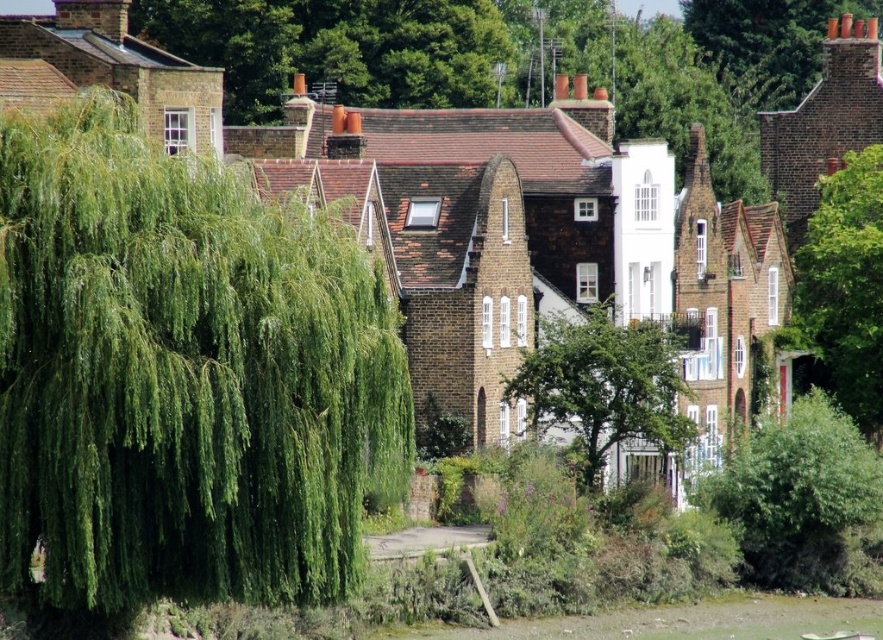
Which is above, green leafy bush at lower right or green leafy tree at center?

green leafy tree at center

Does green leafy bush at lower right appear over green leafy tree at center?

Answer: Actually, green leafy bush at lower right is below green leafy tree at center.

Is point (761, 541) positioned behind point (651, 364)?

Yes, point (761, 541) is behind point (651, 364).

This screenshot has width=883, height=640. I want to click on green leafy bush at lower right, so click(798, 497).

Which is below, green leafy willow at left or green leafy tree at center?

Positioned lower is green leafy willow at left.

Between green leafy willow at left and green leafy tree at center, which one has less height?

green leafy tree at center is shorter.

Looking at this image, measure the distance between point [84,540] and camera.

63.70 meters

You are a GUI agent. You are given a task and a screenshot of the screen. Output one action in this format:
    pyautogui.click(x=<x>, y=<y>)
    Task: Click on the green leafy willow at left
    The image size is (883, 640).
    Given the screenshot: What is the action you would take?
    pyautogui.click(x=183, y=376)

Between green leafy willow at left and green leafy bush at lower right, which one appears on the left side from the viewer's perspective?

Positioned to the left is green leafy willow at left.

Who is higher up, green leafy willow at left or green leafy bush at lower right?

Positioned higher is green leafy willow at left.

The image size is (883, 640). I want to click on green leafy willow at left, so click(x=183, y=376).